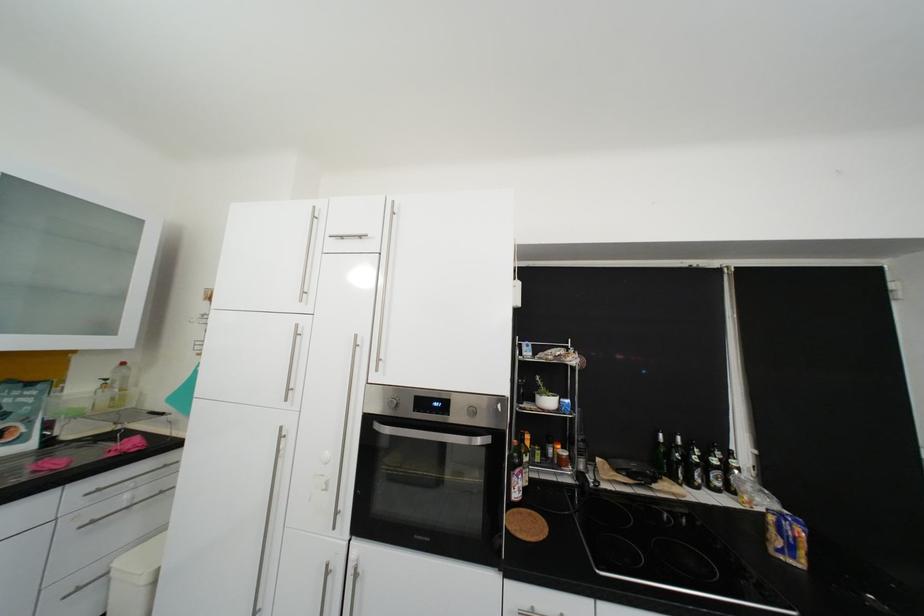
Locate an element on the screen. The image size is (924, 616). silver oven dial is located at coordinates (441, 407).